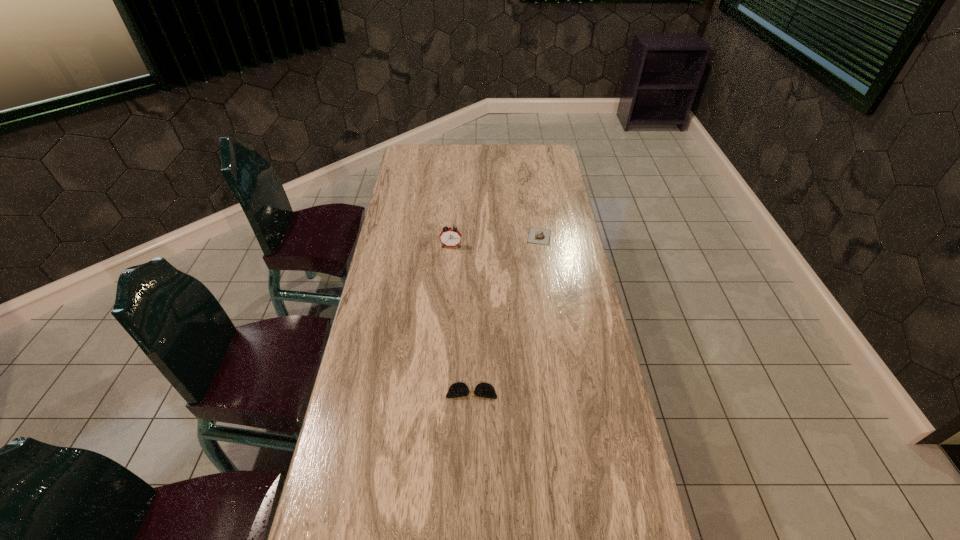
Image resolution: width=960 pixels, height=540 pixels. I want to click on empty location between the spectacles and the alarm clock, so click(x=462, y=319).

Locate an element on the screen. This screenshot has height=540, width=960. free space that is in between the shortest object and the rightmost object is located at coordinates (505, 314).

This screenshot has width=960, height=540. I want to click on vacant space that's between the garlic and the shortest object, so click(505, 314).

I want to click on unoccupied area between the tallest object and the garlic, so click(x=495, y=241).

You are a GUI agent. You are given a task and a screenshot of the screen. Output one action in this format:
    pyautogui.click(x=<x>, y=<y>)
    Task: Click on the second closest object to the rightmost object
    
    Given the screenshot: What is the action you would take?
    pyautogui.click(x=485, y=390)

Identify the location of the second closest object to the spectacles. The height and width of the screenshot is (540, 960). (535, 236).

Image resolution: width=960 pixels, height=540 pixels. Identify the location of vacant space that satisfies the following two spatial constraints: 1. on the clock face of the spectacles; 2. on the left side of the alarm clock. (441, 392).

You are a GUI agent. You are given a task and a screenshot of the screen. Output one action in this format:
    pyautogui.click(x=<x>, y=<y>)
    Task: Click on the free location that satisfies the following two spatial constraints: 1. on the clock face of the alarm clock; 2. on the left side of the nearest object
    The image size is (960, 540).
    Given the screenshot: What is the action you would take?
    pyautogui.click(x=441, y=392)

This screenshot has width=960, height=540. In order to click on vacant space that satisfies the following two spatial constraints: 1. on the clock face of the alarm clock; 2. on the right side of the spectacles in this screenshot , I will do `click(441, 392)`.

I want to click on vacant space that satisfies the following two spatial constraints: 1. on the clock face of the alarm clock; 2. on the right side of the shortest object, so click(x=441, y=392).